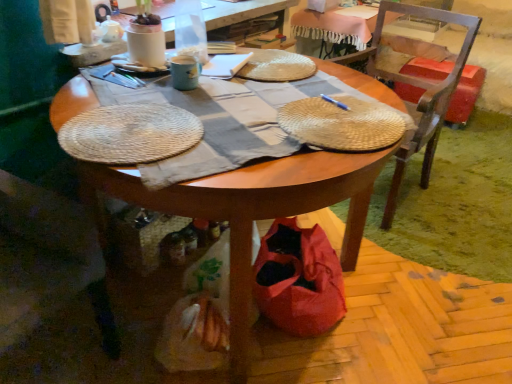
The image size is (512, 384). In order to click on vacant area that lies to the right of translucent plastic bottle at upper center in this screenshot , I will do `click(260, 56)`.